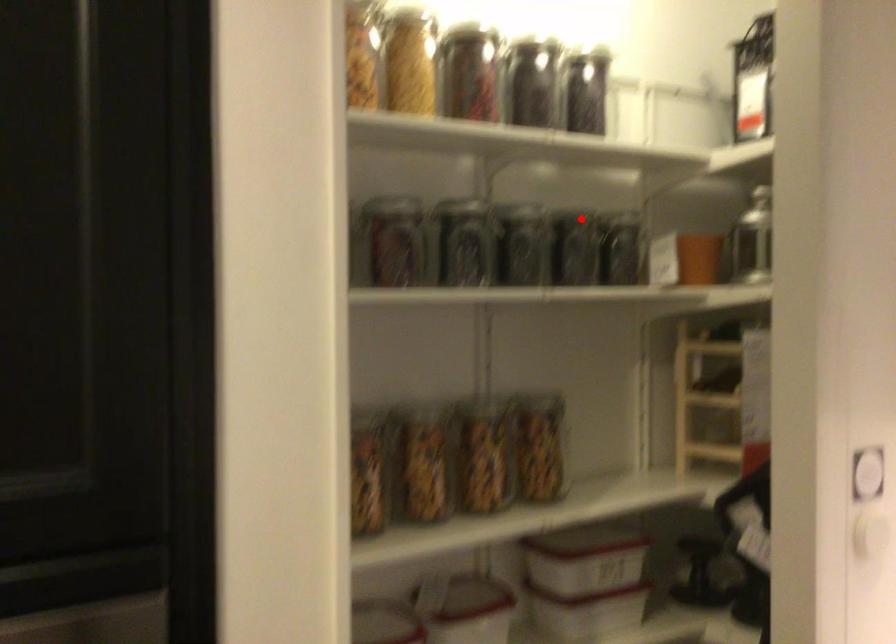
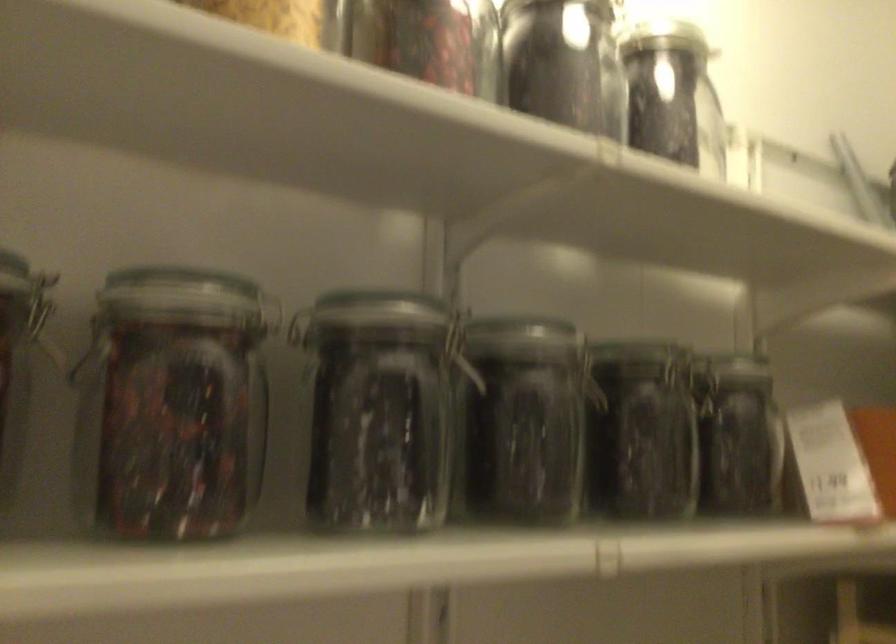
Question: I am providing you with two images of the same scene from different viewpoints. A red point is shown in image1. For the corresponding object point in image2, is it positioned nearer or farther from the camera?

Choices:
 (A) Nearer
 (B) Farther

Answer: (A)